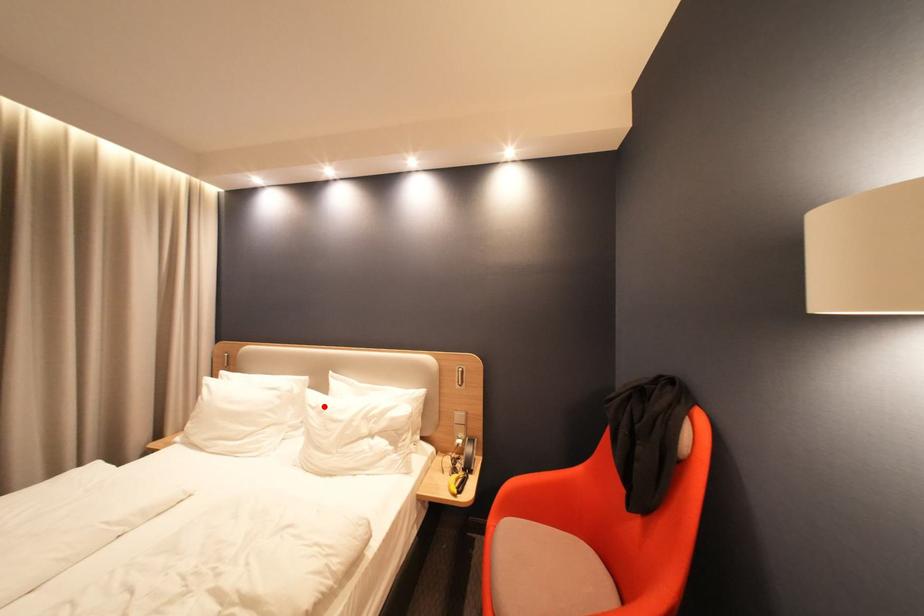
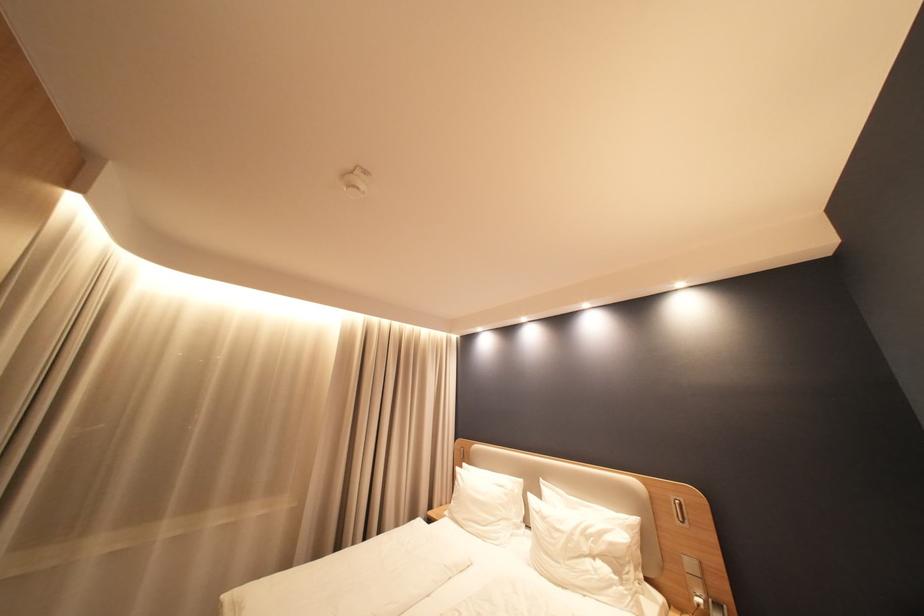
Find the pixel in the second image that matches the highlighted location in the first image.

(546, 511)